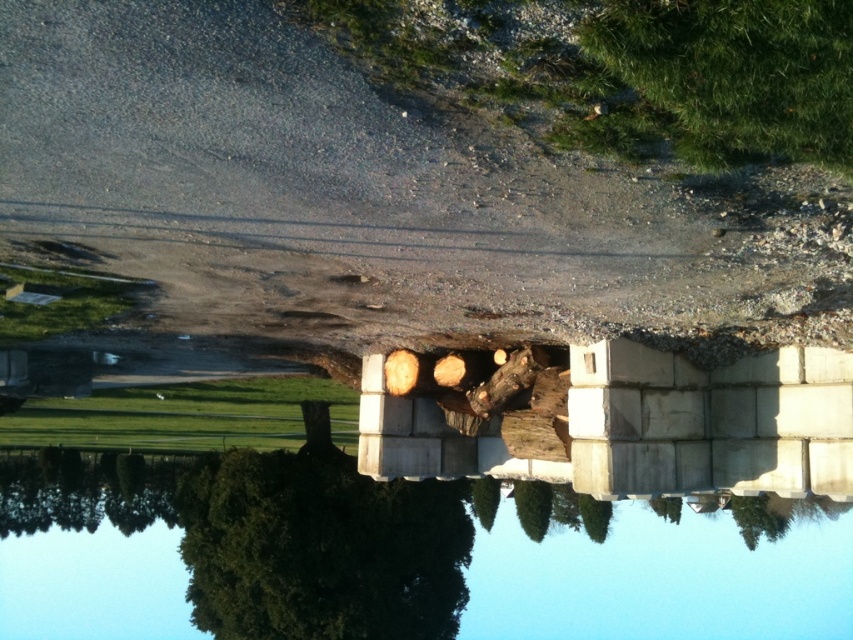
You are standing in front of the stone structure and want to place a new wooden log next to the existing one at the center. Considering the space available, do you think the green fuzzy tree at upper center could block your view of the wooden log at center?

The green fuzzy tree at upper center might be wider than the wooden log at center, so it could potentially block the view depending on their exact positions.